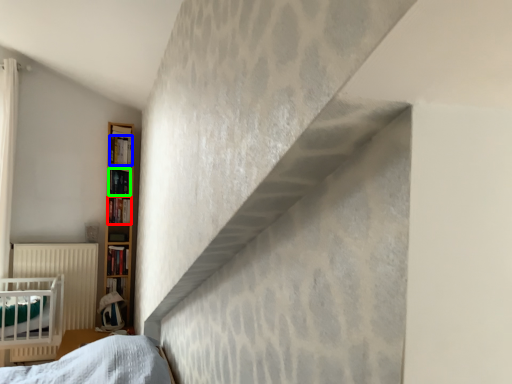
Question: Which object is positioned farthest from book (highlighted by a red box)? Select from book (highlighted by a blue box) and book (highlighted by a green box).

Choices:
 (A) book
 (B) book

Answer: (A)